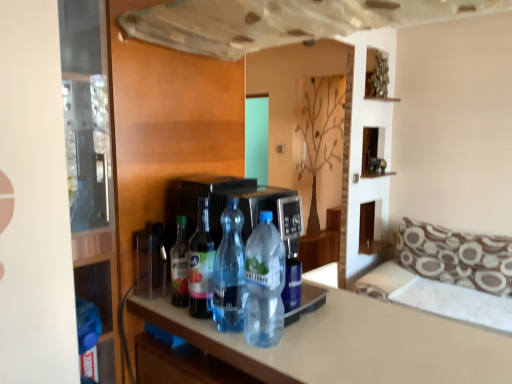
In order to click on free location in front of translucent plastic bottle at center, which is counted as the second bottle, starting from the left in this screenshot , I will do `click(218, 339)`.